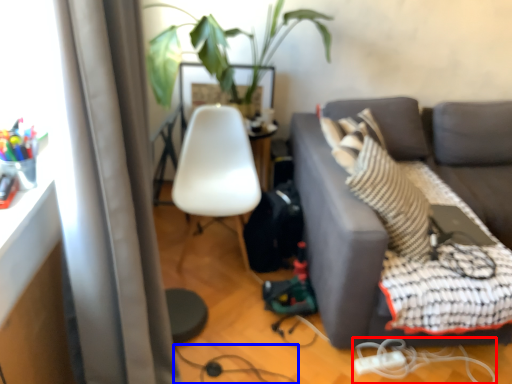
Question: Which point is further to the camera, cable (highlighted by a red box) or cable (highlighted by a blue box)?

Choices:
 (A) cable
 (B) cable

Answer: (B)